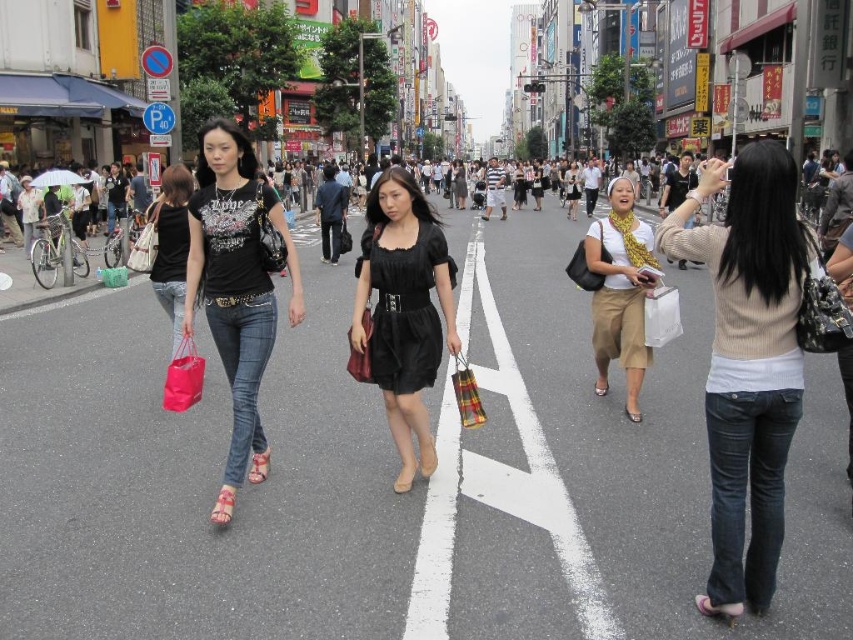
Is point (241, 268) positioned behind point (631, 260)?

No, (241, 268) is in front of (631, 260).

Does matte black shirt at center appear under white matte scarf at center?

No, matte black shirt at center is not below white matte scarf at center.

Identify the location of matte black shirt at center. This screenshot has height=640, width=853. (236, 288).

Locate an element on the screen. This screenshot has width=853, height=640. matte black shirt at center is located at coordinates (236, 288).

Which of these two, matte black shirt at center or matte black tank top at left, stands taller?

With more height is matte black shirt at center.

From the picture: Who is positioned more to the left, matte black shirt at center or matte black tank top at left?

matte black tank top at left

Which is in front, point (271, 323) or point (184, 204)?

Point (271, 323)

Where is `matte black shirt at center`? The image size is (853, 640). matte black shirt at center is located at coordinates (236, 288).

Is matte beige sweater at center shorter than matte black shirt at center?

No.

Does matte beige sweater at center appear over matte black shirt at center?

Incorrect, matte beige sweater at center is not positioned above matte black shirt at center.

Identify the location of matte beige sweater at center. This screenshot has height=640, width=853. 747,362.